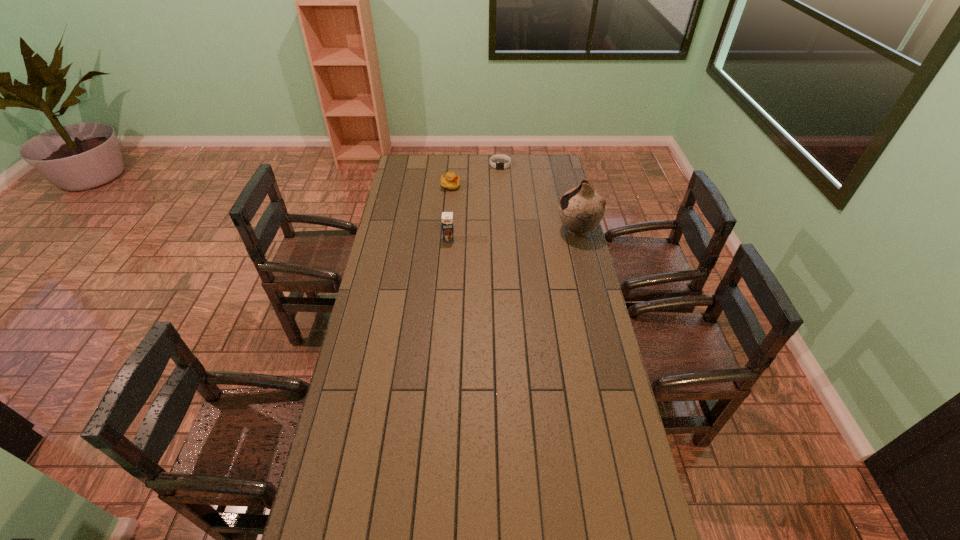
This screenshot has height=540, width=960. Identify the location of empty location between the third tallest object and the farthest object. (475, 176).

Find the location of a particular element. object that is the third closest to the rightmost object is located at coordinates (450, 181).

Image resolution: width=960 pixels, height=540 pixels. Identify the location of the closest object to the third shortest object. tap(450, 181).

This screenshot has height=540, width=960. Find the location of `vacant point that satisfies the following two spatial constraints: 1. on the back side of the wristband; 2. on the right side of the duckling`. vacant point that satisfies the following two spatial constraints: 1. on the back side of the wristband; 2. on the right side of the duckling is located at coordinates (452, 165).